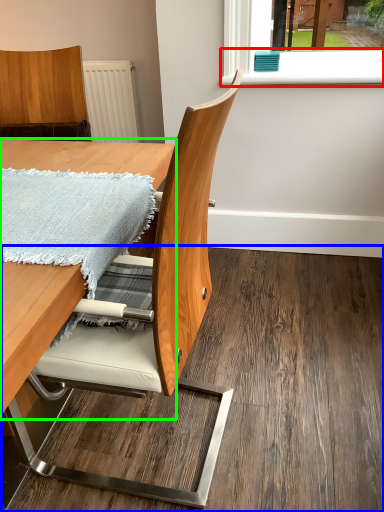
Question: Considering the real-world distances, which object is farthest from window sill (highlighted by a red box)? plywood (highlighted by a blue box) or table (highlighted by a green box)?

Choices:
 (A) plywood
 (B) table

Answer: (A)